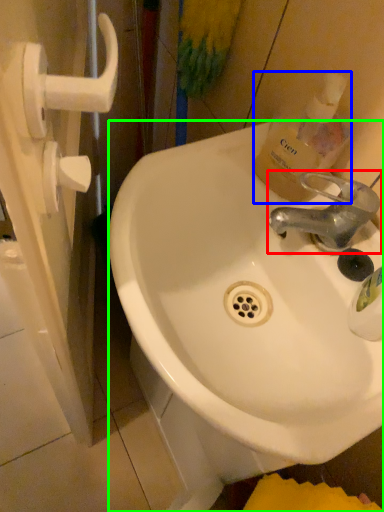
Question: Based on their relative distances, which object is nearer to tap (highlighted by a red box)? Choose from bottle (highlighted by a blue box) and sink (highlighted by a green box).

Choices:
 (A) bottle
 (B) sink

Answer: (A)